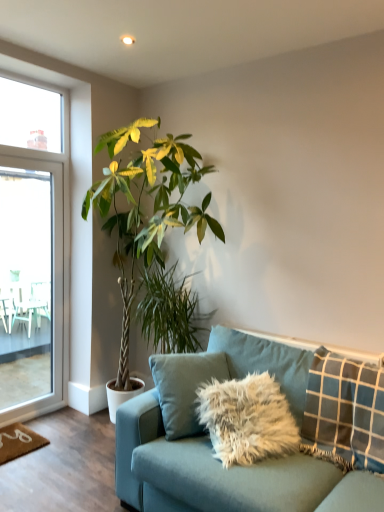
Question: Is teal fabric couch at lower right taller than blue checkered pillow at right?

Choices:
 (A) yes
 (B) no

Answer: (A)

Question: Is teal fabric couch at lower right at the left side of blue checkered pillow at right?

Choices:
 (A) yes
 (B) no

Answer: (A)

Question: From the image's perspective, is teal fabric couch at lower right on blue checkered pillow at right?

Choices:
 (A) no
 (B) yes

Answer: (A)

Question: Is the position of teal fabric couch at lower right more distant than that of blue checkered pillow at right?

Choices:
 (A) no
 (B) yes

Answer: (A)

Question: From a real-world perspective, does teal fabric couch at lower right stand above blue checkered pillow at right?

Choices:
 (A) no
 (B) yes

Answer: (A)

Question: Looking at the image, does green leafy plant at center, marked as the first houseplant in a bottom-to-top arrangement, seem bigger or smaller compared to transparent glass screen door at left?

Choices:
 (A) small
 (B) big

Answer: (B)

Question: Is green leafy plant at center, marked as the first houseplant in a bottom-to-top arrangement, inside the boundaries of transparent glass screen door at left, or outside?

Choices:
 (A) inside
 (B) outside

Answer: (B)

Question: Is point (145, 272) positioned closer to the camera than point (4, 263)?

Choices:
 (A) closer
 (B) farther

Answer: (A)

Question: Looking at their shapes, would you say green leafy plant at center, which is the 2th houseplant in top-to-bottom order, is wider or thinner than transparent glass screen door at left?

Choices:
 (A) wide
 (B) thin

Answer: (A)

Question: Considering the positions of green leafy plant at center, marked as the first houseplant in a bottom-to-top arrangement, and green leafy plant at center, which is counted as the first houseplant, starting from the top, in the image, is green leafy plant at center, marked as the first houseplant in a bottom-to-top arrangement, bigger or smaller than green leafy plant at center, which is counted as the first houseplant, starting from the top,?

Choices:
 (A) small
 (B) big

Answer: (A)

Question: From a real-world perspective, is green leafy plant at center, which is the 2th houseplant in top-to-bottom order, physically located above or below green leafy plant at center, which is counted as the first houseplant, starting from the top?

Choices:
 (A) below
 (B) above

Answer: (A)

Question: Would you say green leafy plant at center, marked as the first houseplant in a bottom-to-top arrangement, is to the left or to the right of green leafy plant at center, which is counted as the first houseplant, starting from the top, in the picture?

Choices:
 (A) right
 (B) left

Answer: (A)

Question: From the image's perspective, is green leafy plant at center, marked as the first houseplant in a bottom-to-top arrangement, located above or below green leafy plant at center, which is counted as the first houseplant, starting from the top?

Choices:
 (A) below
 (B) above

Answer: (A)

Question: Is transparent glass screen door at left to the left or to the right of teal fabric couch at lower right in the image?

Choices:
 (A) left
 (B) right

Answer: (A)

Question: Considering their positions, is transparent glass screen door at left located in front of or behind teal fabric couch at lower right?

Choices:
 (A) front
 (B) behind

Answer: (B)